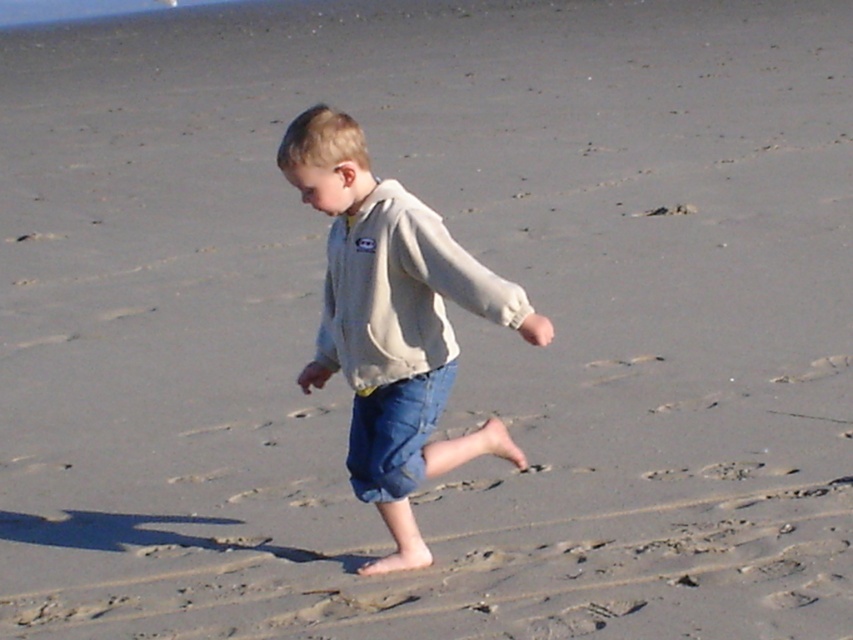
Is light beige fleece jacket at center closer to camera compared to beige fleece sweatshirt at center?

Yes, light beige fleece jacket at center is closer to the viewer.

Does light beige fleece jacket at center have a larger size compared to beige fleece sweatshirt at center?

Indeed, light beige fleece jacket at center has a larger size compared to beige fleece sweatshirt at center.

Which is in front, point (461, 284) or point (402, 356)?

Point (461, 284)

You are a GUI agent. You are given a task and a screenshot of the screen. Output one action in this format:
    pyautogui.click(x=<x>, y=<y>)
    Task: Click on the light beige fleece jacket at center
    The height and width of the screenshot is (640, 853).
    Given the screenshot: What is the action you would take?
    pyautogui.click(x=393, y=323)